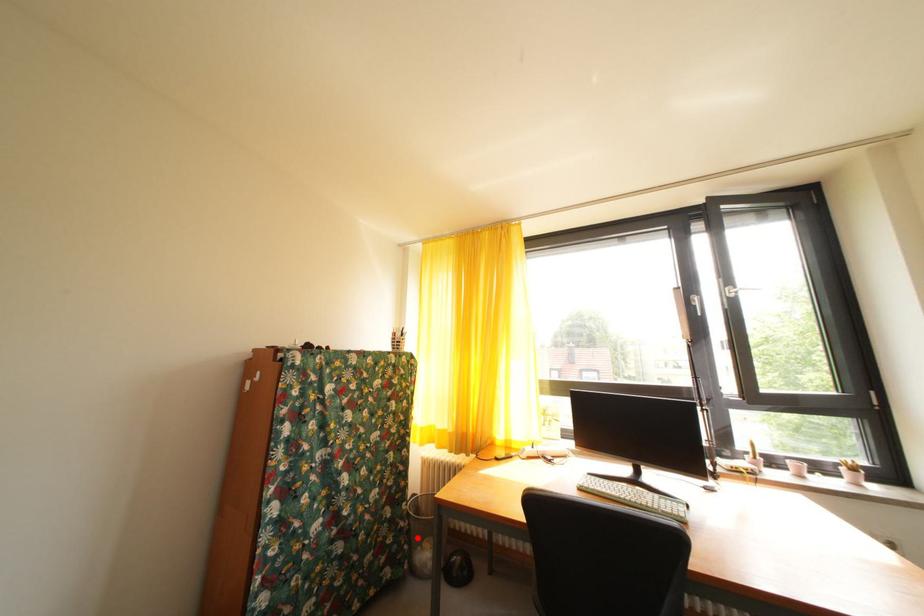
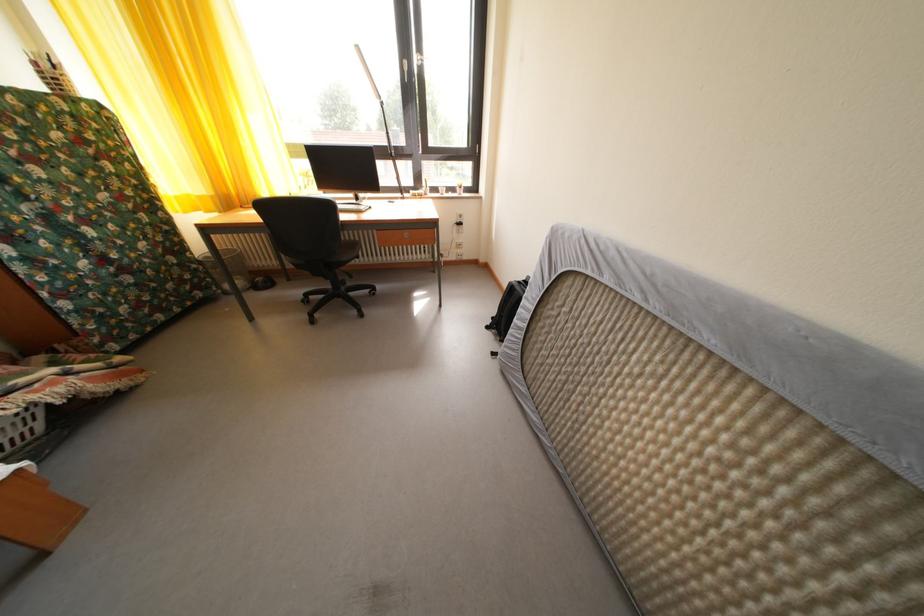
Question: I am providing you with two images of the same scene from different viewpoints. Image1 has a red point marked. In image2, the corresponding 3D location appears at what relative position? Reply with the corresponding letter.

Choices:
 (A) Closer
 (B) Farther

Answer: (A)